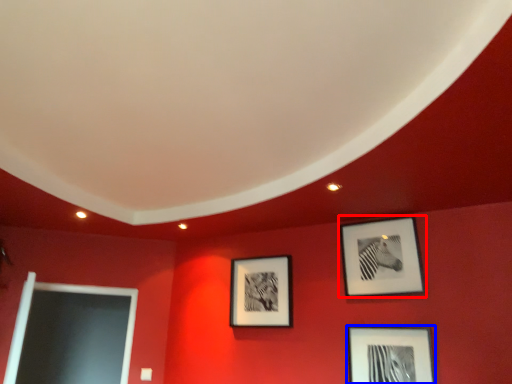
Question: Which object is closer to the camera taking this photo, picture frame (highlighted by a red box) or picture frame (highlighted by a blue box)?

Choices:
 (A) picture frame
 (B) picture frame

Answer: (B)